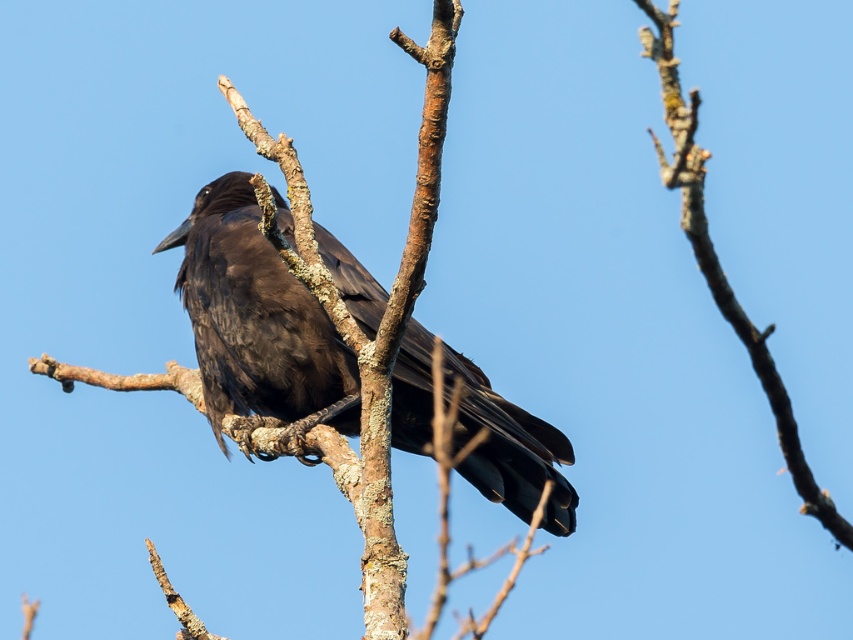
You are a photographer aiming to capture the shiny black raven at center in your shot. Given that your camera frame is centered at coordinates point 0.500, 0.300, will the raven be perfectly centered in your image?

The shiny black raven at center is located at point (257,321), which is very close to the camera frame center at (254,320). The slight difference in coordinates means the raven is slightly off to the right and above the exact center, so it won

You are a birdwatcher observing the scene. You notice the shiny black raven at center and the smooth bark branch at upper center. Which object is taller in the image?

The shiny black raven at center is much taller than the smooth bark branch at upper center according to the description.

You are a birdwatcher observing the scene. You notice the shiny black raven at center and the smooth bark branch at upper center. Which object is located higher in the image?

The smooth bark branch at upper center is higher because the shiny black raven at center is positioned under it.